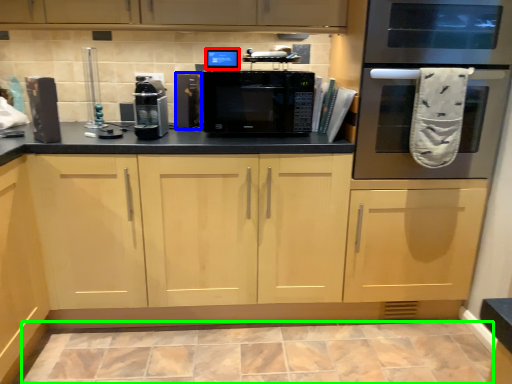
Question: Which object is the closest to the appliance (highlighted by a red box)? Choose among these: appliance (highlighted by a blue box) or ceramic tile (highlighted by a green box).

Choices:
 (A) appliance
 (B) ceramic tile

Answer: (A)